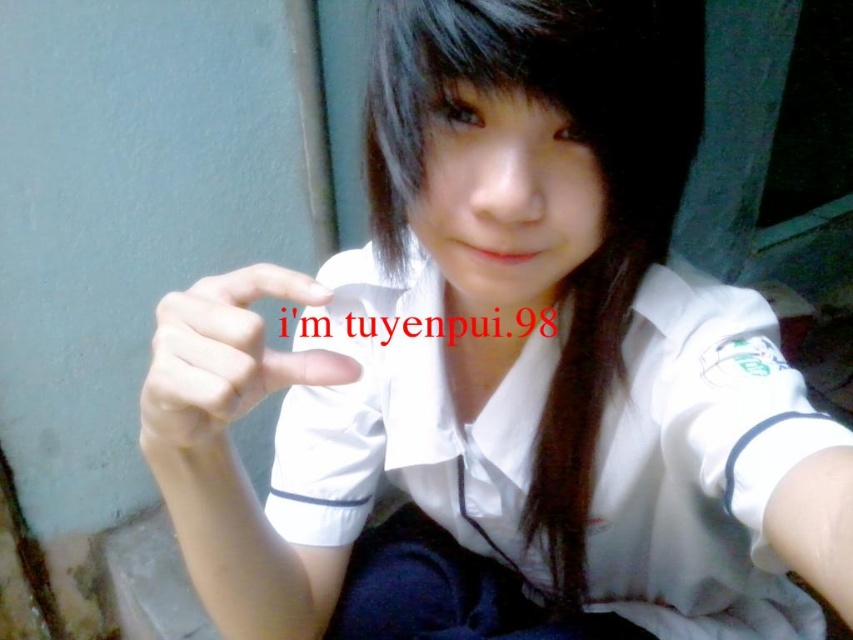
Question: Can you confirm if black silky hair at center is wider than white matte hand at center?

Choices:
 (A) yes
 (B) no

Answer: (A)

Question: Is black silky hair at center to the right of white matte hand at center from the viewer's perspective?

Choices:
 (A) yes
 (B) no

Answer: (A)

Question: Can you confirm if black silky hair at center is wider than white matte hand at center?

Choices:
 (A) yes
 (B) no

Answer: (A)

Question: Which object is closer to the camera taking this photo?

Choices:
 (A) white matte hand at center
 (B) black silky hair at center

Answer: (A)

Question: Which object appears closest to the camera in this image?

Choices:
 (A) white matte hand at center
 (B) black silky hair at center

Answer: (A)